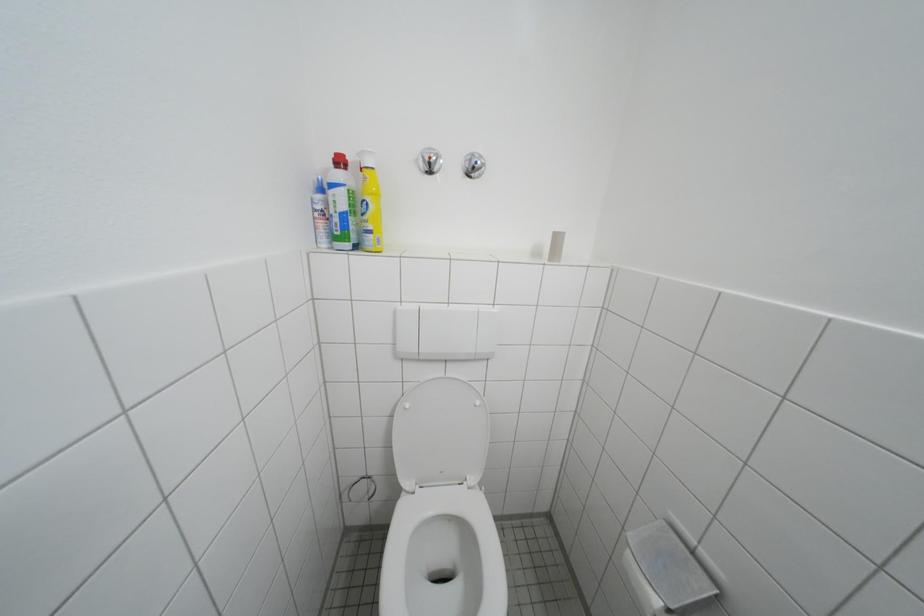
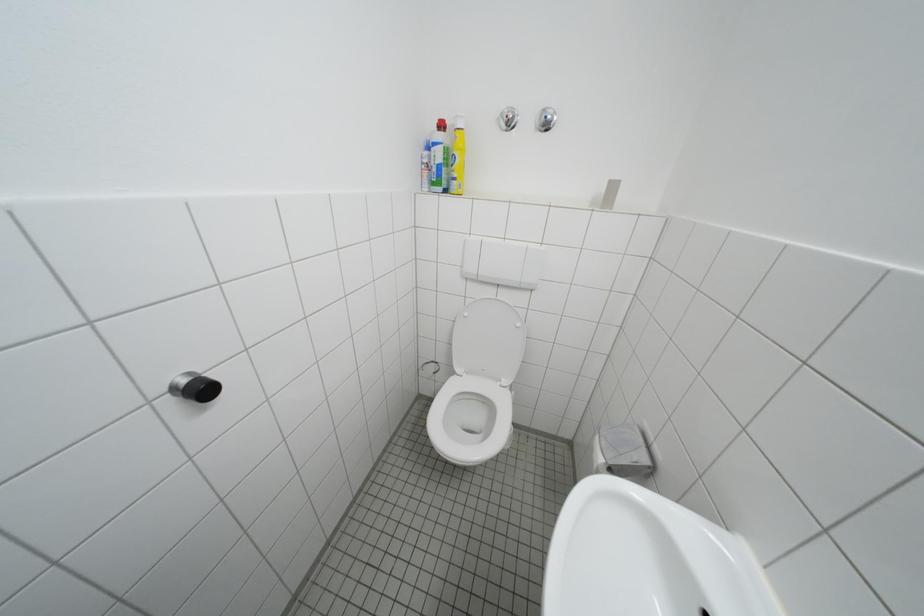
Question: How did the camera likely rotate?

Choices:
 (A) Left
 (B) Right
 (C) Up
 (D) Down

Answer: (A)